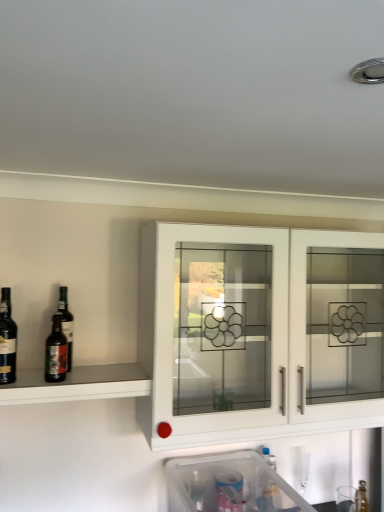
Image resolution: width=384 pixels, height=512 pixels. I want to click on vacant point to the right of dark brown glass bottle at left, which is the second wine from left to right, so click(78, 381).